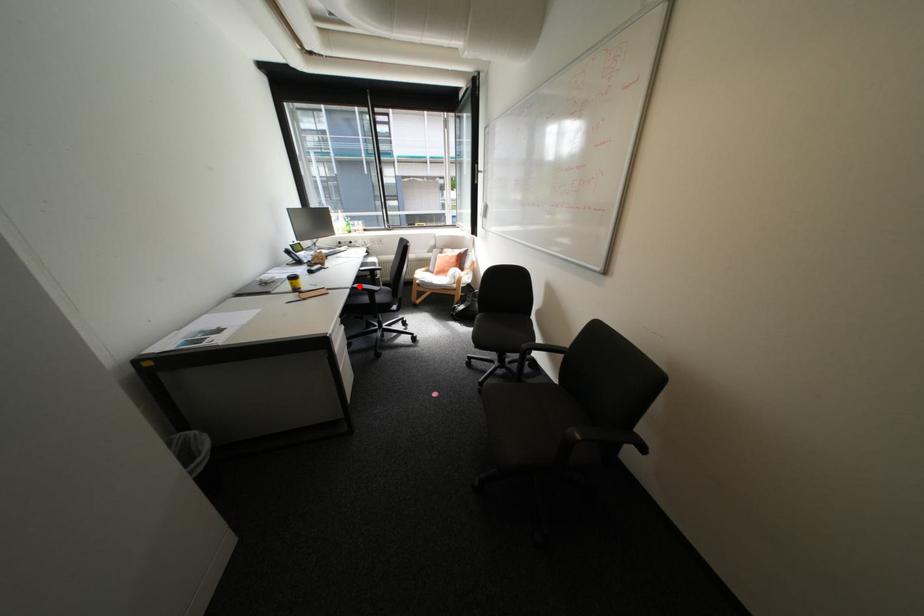
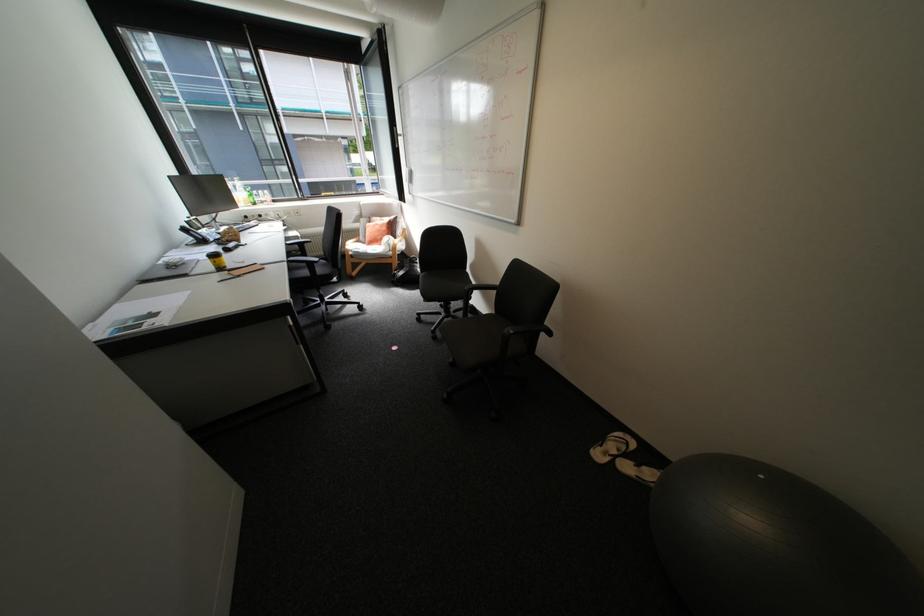
Question: I am providing you with two images of the same scene from different viewpoints. Given a red point in image1, look at the same physical point in image2. Is it:

Choices:
 (A) Closer to the viewpoint
 (B) Farther from the viewpoint

Answer: (A)